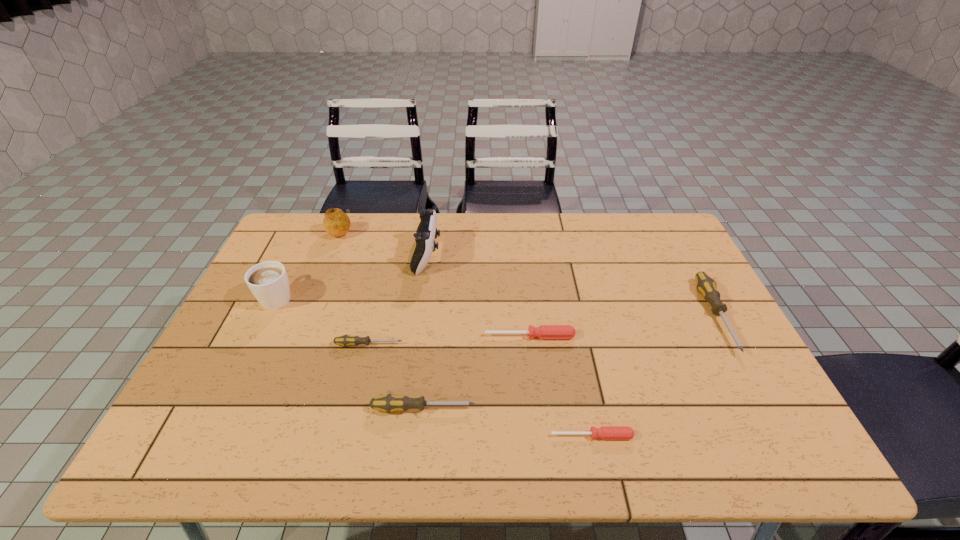
The width and height of the screenshot is (960, 540). Identify the location of vacant space positioned 0.210m at the tip of the smallest gray screwdriver. (483, 345).

Identify the location of vacant area located 0.250m on the right of the nearer red screwdriver. Image resolution: width=960 pixels, height=540 pixels. (746, 436).

The image size is (960, 540). I want to click on control that is at the far edge, so click(x=426, y=232).

Identify the location of pear located in the far edge section of the desktop. The image size is (960, 540). (336, 223).

Locate an element on the screen. object that is at the near edge is located at coordinates (605, 432).

The height and width of the screenshot is (540, 960). I want to click on pear that is at the left edge, so click(x=336, y=223).

Find the location of `cappuccino that is at the left edge`. cappuccino that is at the left edge is located at coordinates (268, 281).

This screenshot has width=960, height=540. I want to click on object at the right edge, so click(705, 285).

I want to click on object that is at the far left corner, so click(336, 223).

Find the location of `free space at the far edge of the desktop`. free space at the far edge of the desktop is located at coordinates (512, 214).